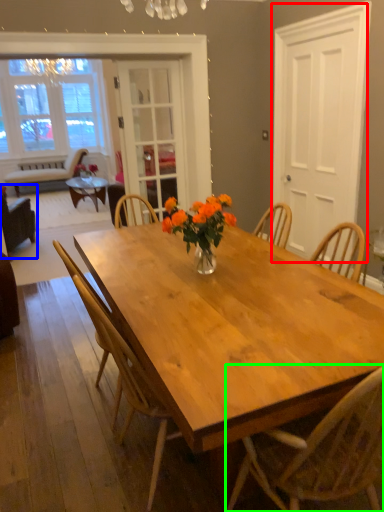
Question: Which object is positioned farthest from screen door (highlighted by a red box)? Select from chair (highlighted by a blue box) and chair (highlighted by a green box).

Choices:
 (A) chair
 (B) chair

Answer: (A)